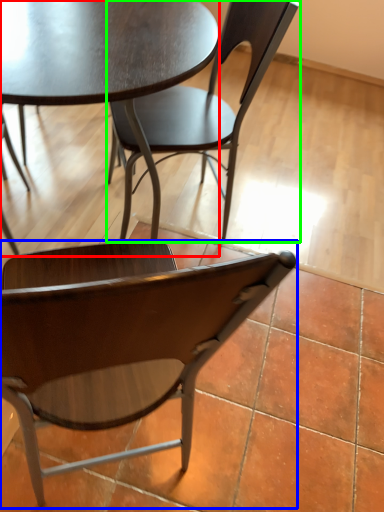
Question: Based on their relative distances, which object is nearer to coffee table (highlighted by a red box)? Choose from chair (highlighted by a blue box) and chair (highlighted by a green box).

Choices:
 (A) chair
 (B) chair

Answer: (B)